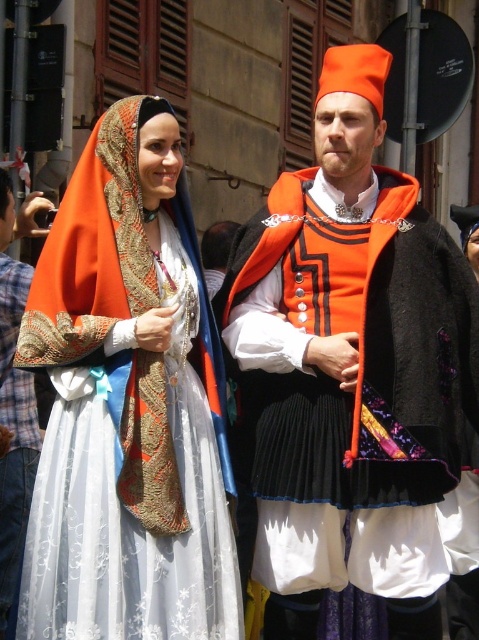
Question: Is matte orange shawl at center above matte orange fabric at center?

Choices:
 (A) yes
 (B) no

Answer: (A)

Question: Can you confirm if matte orange shawl at center is smaller than matte orange fabric at center?

Choices:
 (A) yes
 (B) no

Answer: (B)

Question: Among these objects, which one is farthest from the camera?

Choices:
 (A) matte orange fabric at center
 (B) matte orange shawl at center

Answer: (A)

Question: Is matte orange shawl at center positioned behind matte orange fabric at center?

Choices:
 (A) no
 (B) yes

Answer: (A)

Question: Which point is farther from the camera taking this photo?

Choices:
 (A) coord(166,282)
 (B) coord(9,540)

Answer: (B)